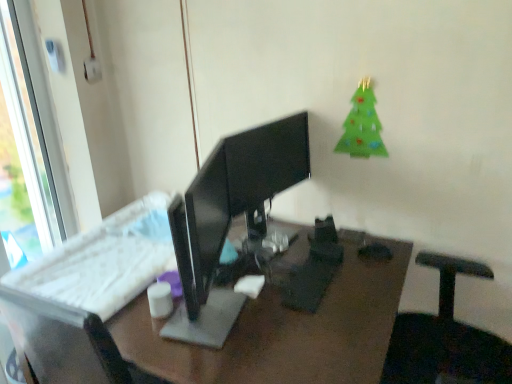
Question: From a real-world perspective, is green felt christmas tree at upper right on top of black glossy monitor at center?

Choices:
 (A) yes
 (B) no

Answer: (A)

Question: Is green felt christmas tree at upper right thinner than black glossy monitor at center?

Choices:
 (A) no
 (B) yes

Answer: (B)

Question: Is green felt christmas tree at upper right outside of black glossy monitor at center?

Choices:
 (A) no
 (B) yes

Answer: (B)

Question: Can you confirm if green felt christmas tree at upper right is positioned to the left of black glossy monitor at center?

Choices:
 (A) yes
 (B) no

Answer: (B)

Question: Is green felt christmas tree at upper right aimed at black glossy monitor at center?

Choices:
 (A) yes
 (B) no

Answer: (B)

Question: Is green felt christmas tree at upper right positioned far away from black glossy monitor at center?

Choices:
 (A) yes
 (B) no

Answer: (B)

Question: Is green felt christmas tree at upper right to the left of white plastic keyboard at center from the viewer's perspective?

Choices:
 (A) yes
 (B) no

Answer: (B)

Question: Is green felt christmas tree at upper right not near white plastic keyboard at center?

Choices:
 (A) no
 (B) yes

Answer: (A)

Question: Is green felt christmas tree at upper right looking in the opposite direction of white plastic keyboard at center?

Choices:
 (A) no
 (B) yes

Answer: (A)

Question: Considering the relative positions of green felt christmas tree at upper right and white plastic keyboard at center in the image provided, is green felt christmas tree at upper right to the right of white plastic keyboard at center from the viewer's perspective?

Choices:
 (A) no
 (B) yes

Answer: (B)

Question: Is green felt christmas tree at upper right next to white plastic keyboard at center?

Choices:
 (A) yes
 (B) no

Answer: (B)

Question: From a real-world perspective, does green felt christmas tree at upper right sit lower than white plastic keyboard at center?

Choices:
 (A) yes
 (B) no

Answer: (B)

Question: Considering the relative positions of white matte cup at center and black glossy monitor at center in the image provided, is white matte cup at center to the left of black glossy monitor at center from the viewer's perspective?

Choices:
 (A) yes
 (B) no

Answer: (A)